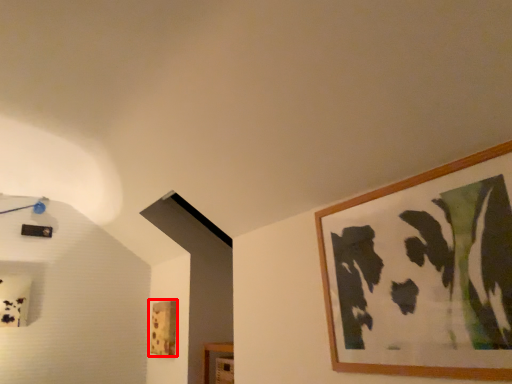
Question: Observing the image, what is the correct spatial positioning of picture frame (annotated by the red box) in reference to picture frame?

Choices:
 (A) left
 (B) right

Answer: (A)